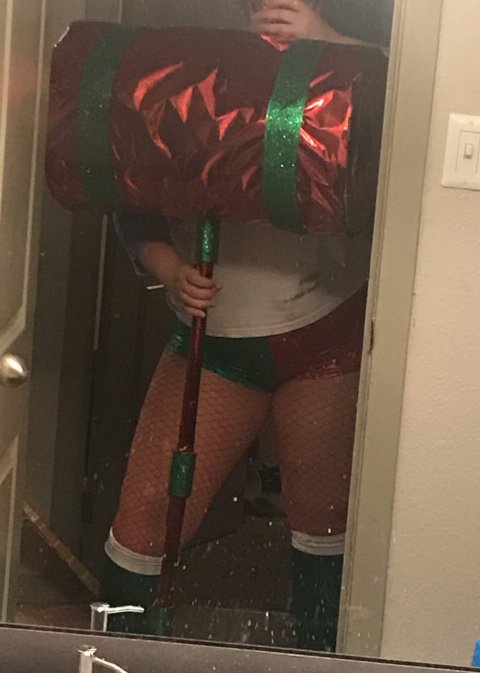
This screenshot has width=480, height=673. Find the location of `tube of soap dispenser`. tube of soap dispenser is located at coordinates (x=113, y=667).